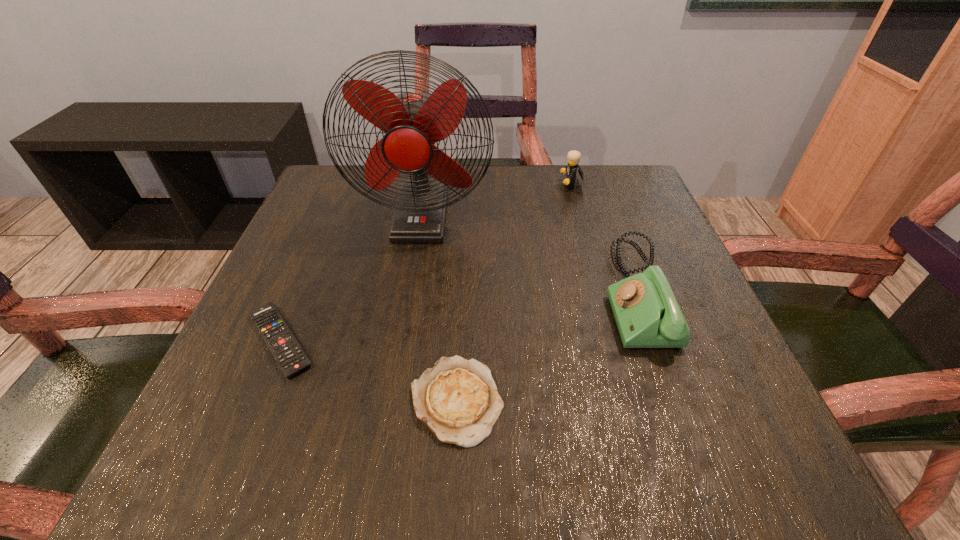
You are a GUI agent. You are given a task and a screenshot of the screen. Output one action in this format:
    pyautogui.click(x=<x>, y=<y>)
    Task: Click on the free spot between the tallest object and the telephone
    The width and height of the screenshot is (960, 540).
    Given the screenshot: What is the action you would take?
    pyautogui.click(x=529, y=255)

Where is `object that ranks as the second closest to the tallest object`? object that ranks as the second closest to the tallest object is located at coordinates (291, 358).

Point out which object is positioned as the second nearest to the telephone. Please provide its 2D coordinates. Your answer should be formatted as a tuple, i.e. [(x, y)], where the tuple contains the x and y coordinates of a point satisfying the conditions above.

[(458, 400)]

Find the location of a particular element. Image resolution: width=960 pixels, height=540 pixels. free space that satisfies the following two spatial constraints: 1. on the front-facing side of the Lego; 2. on the front-facing side of the tallest object is located at coordinates (581, 216).

Identify the location of vacant space that satisfies the following two spatial constraints: 1. on the front-facing side of the Lego; 2. on the front-facing side of the tallest object. (581, 216).

Identify the location of free location that satisfies the following two spatial constraints: 1. on the front-facing side of the tallest object; 2. on the right side of the quiche. This screenshot has height=540, width=960. (390, 400).

I want to click on vacant space that satisfies the following two spatial constraints: 1. on the front-facing side of the fan; 2. on the right side of the quiche, so click(x=390, y=400).